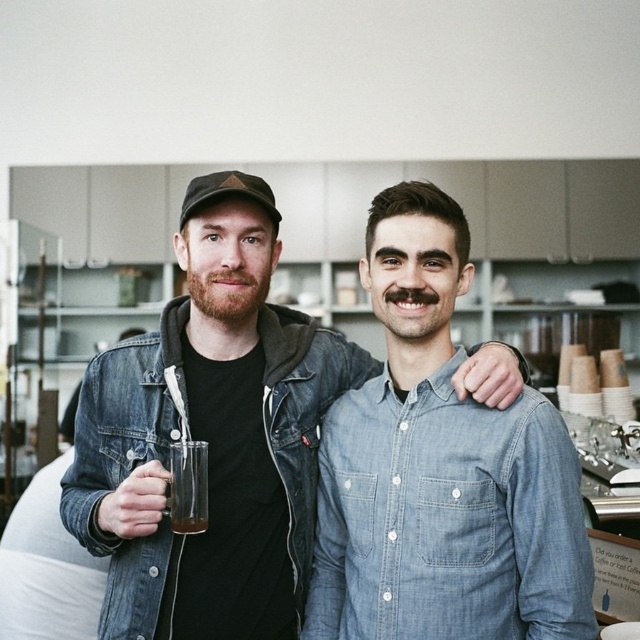
You are a delivery robot that needs to drop off a package at point (412, 621) in the image. The robot has a maximum delivery range of 1.2 meters. Can you deliver the package to that point?

The distance of point (412, 621) from camera is 1.18 meters, so yes, the robot can deliver the package to that point since it is within the maximum delivery range of 1.2 meters.

You are a photographer setting up a shot in this scene. You want to ensure that both the denim jacket at center and the translucent glass at lower left are clearly visible in the frame. Based on their positions, which object should you position closer to the camera to keep both in focus without moving the camera?

The denim jacket at center is to the right of the translucent glass at lower left. To keep both in focus, position the translucent glass at lower left closer to the camera since it is farther away and needs to be within the depth of field range.

You are a customer in the cafe and you want to place your order. The cashier is at the point denoted by point (209, 436). You are standing at the entrance, which is to the left of the denim jacket at center. Which direction should you move to reach the cashier?

The denim jacket at center is located at point (209, 436). Since you are to the left of the denim jacket at center, you should move to the right to reach the cashier at point (209, 436).